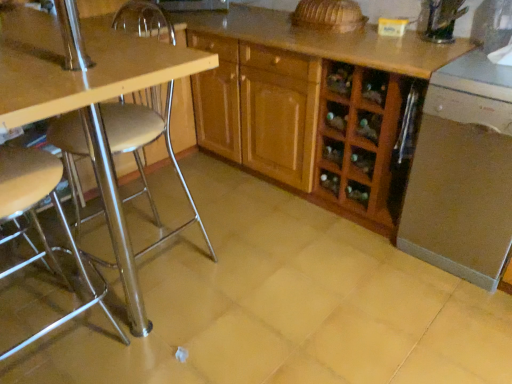
Locate an element on the screen. Image resolution: width=512 pixels, height=384 pixels. spots to the right of metallic silver stool at left is located at coordinates (165, 337).